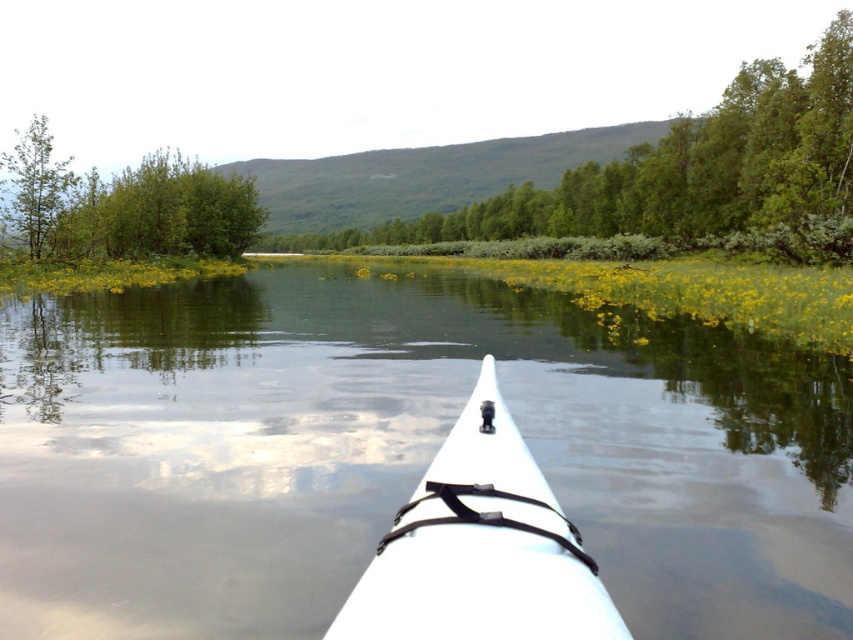
You are in a kayak and want to know if the green leafy trees at upper center are wider than the green leafy tree at left. Can you confirm this based on the scene?

The green leafy trees at upper center are wider than the green leafy tree at left according to the description.

You are navigating a kayak and want to know if the green leafy trees at upper center are bigger than the white matte kayak at center. Can you confirm this based on the scene?

The green leafy trees at upper center is larger in size than white matte kayak at center, so yes, the green leafy trees at upper center are bigger than the white matte kayak at center.

You are in a kayak looking forward. You see two points in the scene, point (561, 193) and point (474, 612). Which point is closer to you?

Point (561, 193) is further to the viewer than point (474, 612), so the closer point to you is point (474, 612).